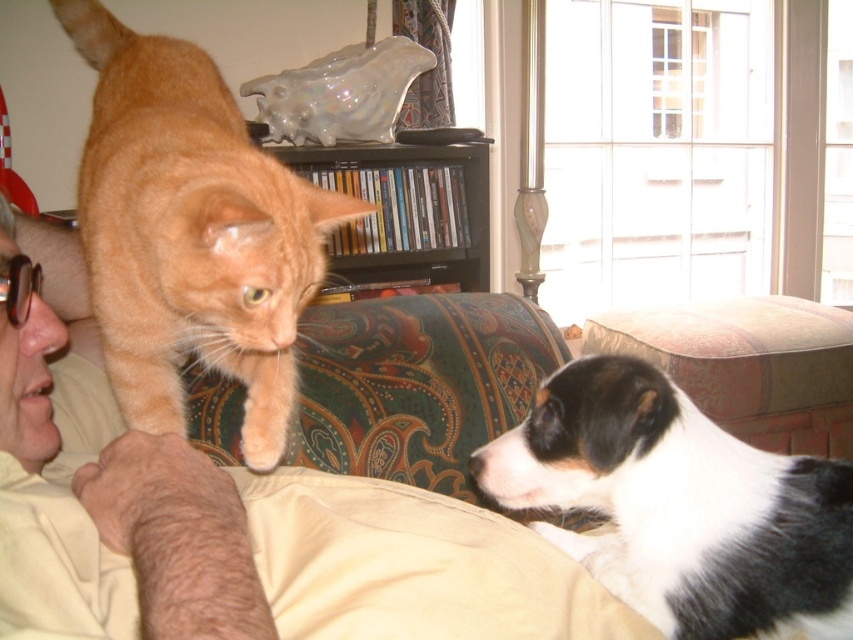
Does orange fur cat at upper left appear on the left side of black and white fur at lower right?

Correct, you'll find orange fur cat at upper left to the left of black and white fur at lower right.

Is orange fur cat at upper left positioned before black and white fur at lower right?

That is True.

This screenshot has width=853, height=640. In order to click on orange fur cat at upper left in this screenshot , I will do `click(190, 232)`.

Is orange fur cat at upper left to the right of black glossy bookshelf at upper center from the viewer's perspective?

Incorrect, orange fur cat at upper left is not on the right side of black glossy bookshelf at upper center.

Is point (125, 44) farther from viewer compared to point (373, 266)?

No, (125, 44) is in front of (373, 266).

Image resolution: width=853 pixels, height=640 pixels. I want to click on orange fur cat at upper left, so click(190, 232).

Does black and white fur at lower right have a smaller size compared to black glossy bookshelf at upper center?

Yes.

Is black and white fur at lower right positioned at the back of black glossy bookshelf at upper center?

No, it is in front of black glossy bookshelf at upper center.

Identify the location of black and white fur at lower right. (679, 506).